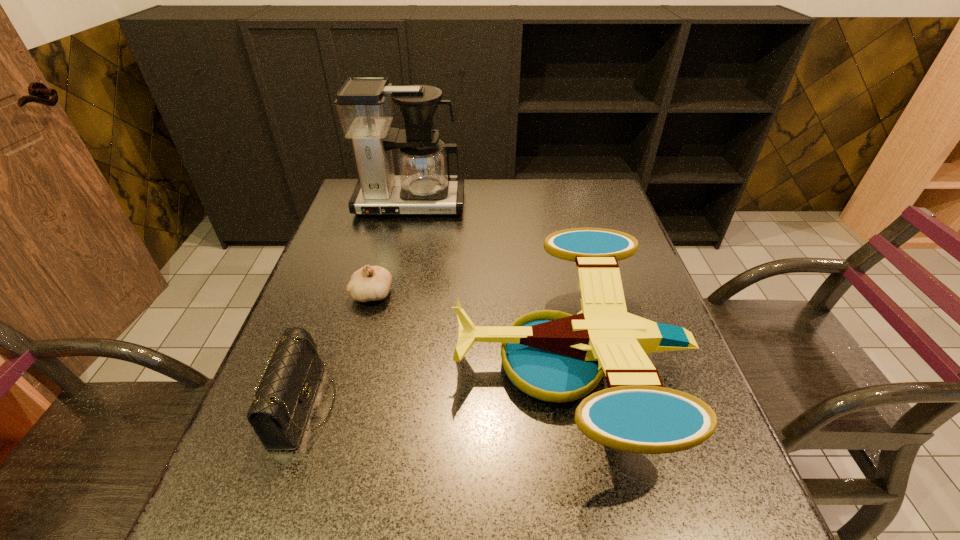
You are a GUI agent. You are given a task and a screenshot of the screen. Output one action in this format:
    pyautogui.click(x=<x>, y=<y>)
    Task: Click on the tallest object
    The height and width of the screenshot is (540, 960).
    Given the screenshot: What is the action you would take?
    pyautogui.click(x=424, y=185)

Locate an element on the screen. coffee maker is located at coordinates (424, 185).

This screenshot has height=540, width=960. I want to click on the third shortest object, so click(552, 356).

Where is `clutch bag`? This screenshot has width=960, height=540. clutch bag is located at coordinates 285,392.

At what (x,y) coordinates should I click in order to perform the action: click on the shortest object. Please return your answer as a coordinate pair (x, y). Image resolution: width=960 pixels, height=540 pixels. Looking at the image, I should click on (370, 283).

At what (x,y) coordinates should I click in order to perform the action: click on vacant region located at the front of the tallest object where the controls are located. Please return your answer as a coordinate pair (x, y). This screenshot has height=540, width=960. Looking at the image, I should click on (403, 233).

I want to click on free region located 0.080m at the cockpit of the third shortest object, so click(418, 362).

The height and width of the screenshot is (540, 960). I want to click on free spot located 0.150m at the cockpit of the third shortest object, so click(x=384, y=362).

Find the location of a particular element. The height and width of the screenshot is (540, 960). free spot located at the cockpit of the third shortest object is located at coordinates (296, 362).

Where is `free space located on the front flap of the third tallest object`? free space located on the front flap of the third tallest object is located at coordinates (538, 405).